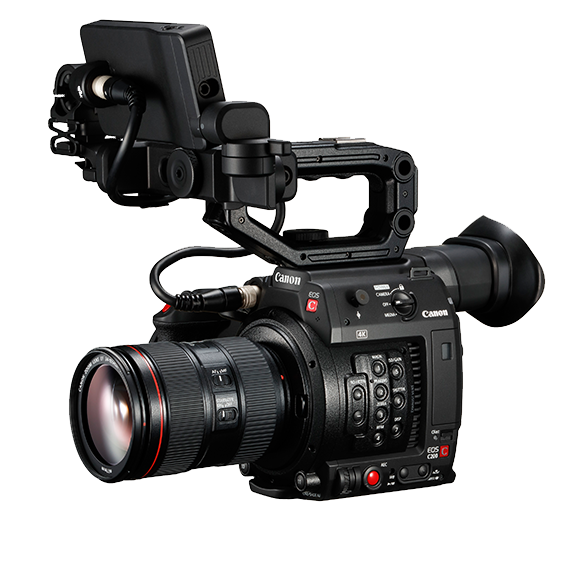
Where is `video screen`? Image resolution: width=580 pixels, height=580 pixels. video screen is located at coordinates (192, 60).